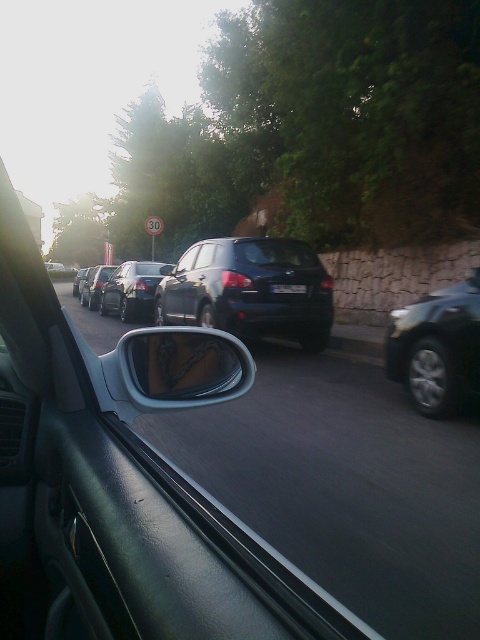
You are a passenger in the car and want to check the rearview mirror to see if the road is clear. However, you notice the glossy plastic car mirror at center and the satin black sedan at center. Which object is closer to you in the car?

The glossy plastic car mirror at center is in front of the satin black sedan at center, so it is closer to you.

You are a passenger in the car and want to check the rearview mirror to see the road behind. Is the glossy plastic car mirror at center positioned in a place where you can easily see the road behind the car?

The glossy plastic car mirror at center is positioned at point (180,368), which is within the driver and passenger side window area, so yes, the passenger can easily see the road behind through the glossy plastic car mirror at center.

You are a passenger in the car and want to know if the shiny silver sedan at center is taller than the satin black car at right. Based on the scene outside, can you determine which vehicle is taller?

The satin black car at right is not as tall as shiny silver sedan at center, so the shiny silver sedan at center is taller.